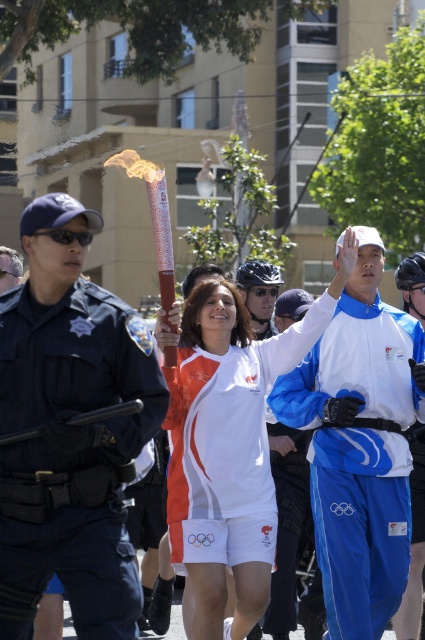
You are a photographer positioned at the starting line of the Olympic torch relay. You need to capture a photo where both the shiny metallic torch at center and the black uniform at left are visible in the frame. The camera you have can capture a maximum distance of 4 meters between objects. Will you be able to include both in the same photo?

The shiny metallic torch at center and the black uniform at left are 3.81 meters apart from each other. Since the camera can capture up to 4 meters between objects, both can be included in the same photo.